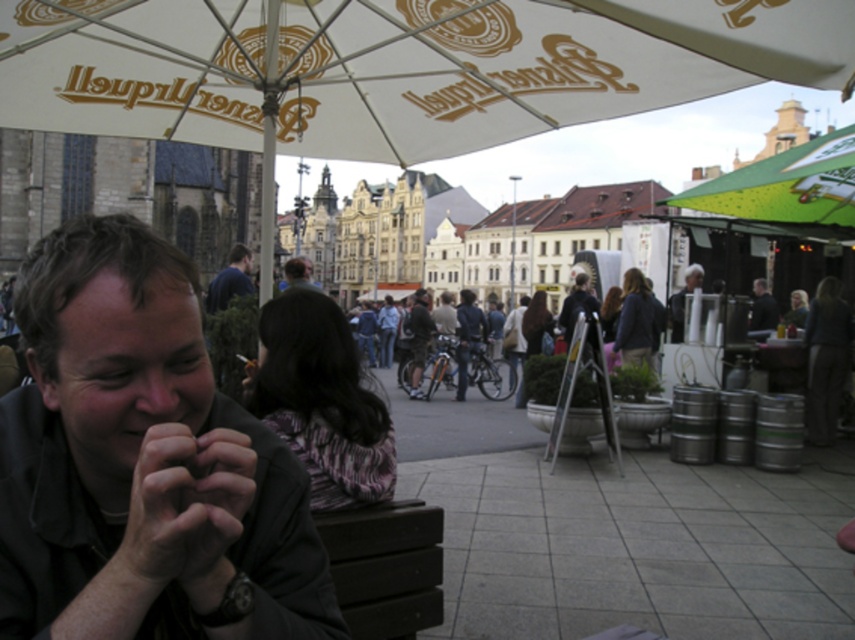
Question: Among these objects, which one is farthest from the camera?

Choices:
 (A) dark gray shirt at center
 (B) white fabric umbrella at upper center
 (C) dark gray fabric jacket at center

Answer: (C)

Question: Which point is closer to the camera taking this photo?

Choices:
 (A) pos(416,340)
 (B) pos(189,474)
 (C) pos(673,298)

Answer: (B)

Question: Is white fabric umbrella at upper center above dark gray shirt at center?

Choices:
 (A) yes
 (B) no

Answer: (A)

Question: Does dark skin hand at center have a larger size compared to dark gray jacket at center?

Choices:
 (A) no
 (B) yes

Answer: (B)

Question: Is white fabric umbrella at upper center below dark skin hand at center?

Choices:
 (A) no
 (B) yes

Answer: (A)

Question: Which of the following is the closest to the observer?

Choices:
 (A) gray fabric jacket at upper right
 (B) dark gray fabric jacket at center
 (C) white fabric umbrella at upper center
 (D) dark skin hand at center

Answer: (D)